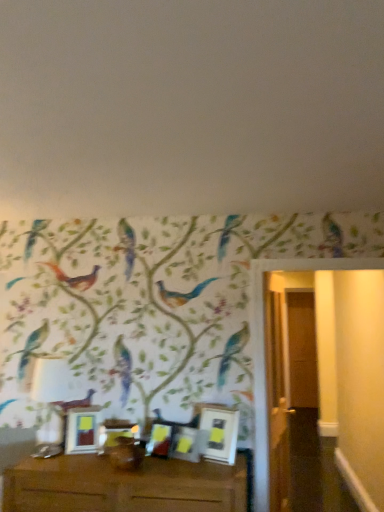
Question: Does point (152, 431) appear closer or farther from the camera than point (77, 433)?

Choices:
 (A) farther
 (B) closer

Answer: (A)

Question: Considering their positions, is matte white picture frame at center, which is counted as the 3th picture frame, starting from the left, located in front of or behind matte white picture frame at center, the first picture frame from the left?

Choices:
 (A) front
 (B) behind

Answer: (A)

Question: Which object is the closest to the matte white picture frame at center, which is the 3th picture frame from right to left?

Choices:
 (A) matte white picture frame at center, the 1th picture frame from the right
 (B) matte white picture frame at center, the first picture frame from the left
 (C) matte gold picture frame at center, the 4th picture frame when ordered from right to left
 (D) matte white picture frame at center, the second picture frame from the right
 (E) brown wooden table at lower center

Answer: (D)

Question: Estimate the real-world distances between objects in this image. Which object is closer to the matte white picture frame at center, the first picture frame from the left?

Choices:
 (A) matte white picture frame at center, which is the 3th picture frame from right to left
 (B) matte gold picture frame at center, the 4th picture frame when ordered from right to left
 (C) matte white picture frame at center, the 1th picture frame from the right
 (D) matte white picture frame at center, which appears as the 4th picture frame when viewed from the left
 (E) brown wooden table at lower center

Answer: (B)